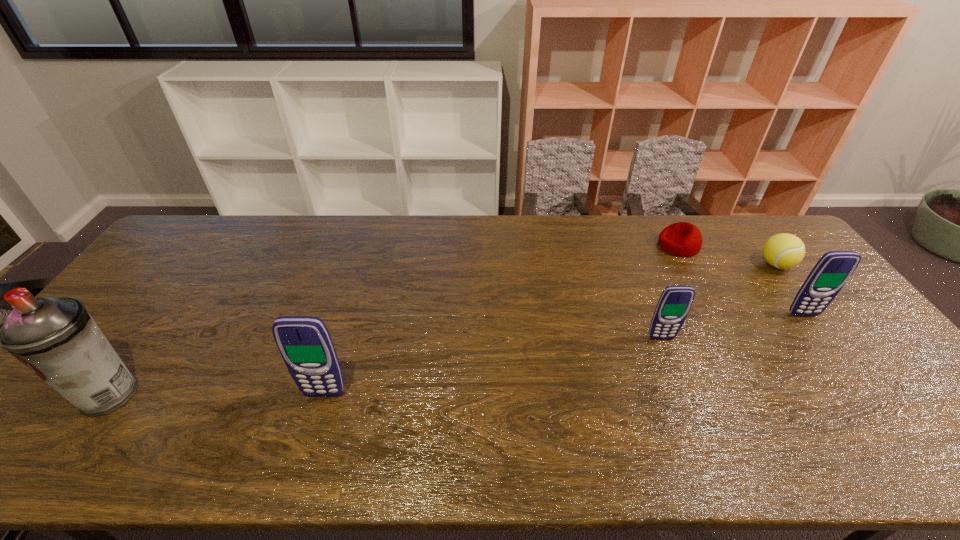
Where is `tennis ball at the far edge`? tennis ball at the far edge is located at coordinates (783, 251).

Identify the location of cellular telephone that is at the near edge. The image size is (960, 540). (304, 342).

The width and height of the screenshot is (960, 540). I want to click on aerosol can positioned at the near edge, so click(55, 337).

You are a GUI agent. You are given a task and a screenshot of the screen. Output one action in this format:
    pyautogui.click(x=<x>, y=<y>)
    Task: Click on the object at the left edge
    This screenshot has height=540, width=960.
    Given the screenshot: What is the action you would take?
    pyautogui.click(x=55, y=337)

Image resolution: width=960 pixels, height=540 pixels. Find the location of `cellular telephone that is at the right edge`. cellular telephone that is at the right edge is located at coordinates [x=832, y=271].

Image resolution: width=960 pixels, height=540 pixels. I want to click on tennis ball that is at the right edge, so click(x=783, y=251).

Find the location of a particular element. The height and width of the screenshot is (540, 960). object that is at the near left corner is located at coordinates (55, 337).

Find the location of a particular element. The height and width of the screenshot is (540, 960). object situated at the far right corner is located at coordinates (783, 251).

The image size is (960, 540). Identify the location of vacant space at the far edge. (268, 248).

Where is `vacant region at the left edge of the desktop`? vacant region at the left edge of the desktop is located at coordinates (107, 330).